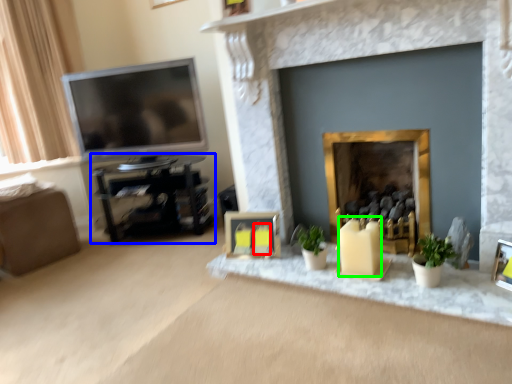
Question: Considering the real-world distances, which object is farthest from candle (highlighted by a red box)? entertainment center (highlighted by a blue box) or candle (highlighted by a green box)?

Choices:
 (A) entertainment center
 (B) candle

Answer: (A)